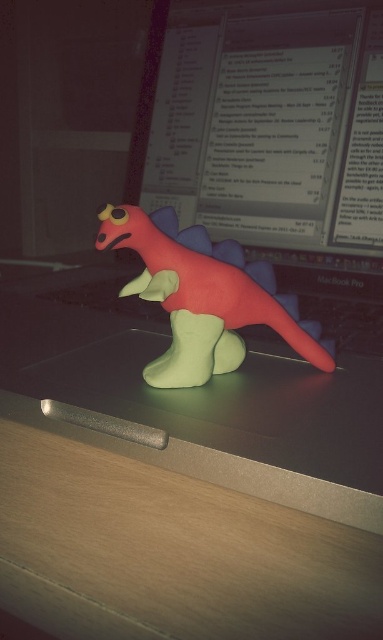
You are setting up a small desk area and need to place both the wooden table at lower center and the matte plastic computer screen at upper center on a shelf. The shelf has a depth limit of 10 cm. Which object might not fit based on their thickness?

The wooden table at lower center is thinner than the matte plastic computer screen at upper center. Since the shelf has a depth limit of 10 cm, the matte plastic computer screen at upper center might not fit due to its greater thickness compared to the wooden table at lower center.